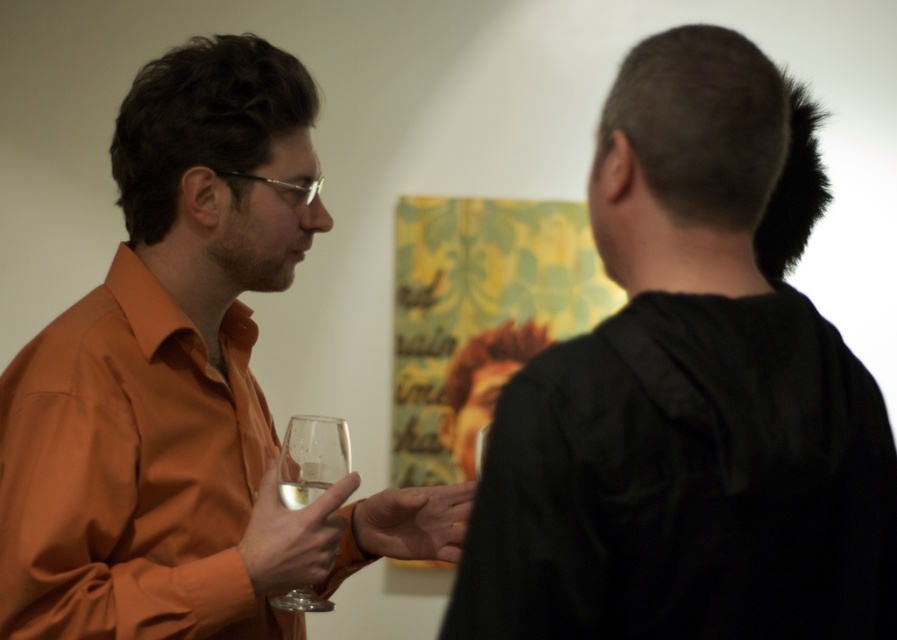
Is orange matte shirt at left smaller than clear glass wine glass at center?

No.

Does orange matte shirt at left appear on the left side of clear glass wine glass at center?

Correct, you'll find orange matte shirt at left to the left of clear glass wine glass at center.

Does point (24, 532) lie in front of point (324, 440)?

Yes, it is.

Where is `orange matte shirt at left`? orange matte shirt at left is located at coordinates (185, 387).

Is black matte shirt at upper right thinner than clear glass wine at center?

Incorrect, black matte shirt at upper right's width is not less than clear glass wine at center's.

Between black matte shirt at upper right and clear glass wine at center, which one appears on the right side from the viewer's perspective?

black matte shirt at upper right is more to the right.

Does point (747, 355) come behind point (316, 484)?

No, (747, 355) is in front of (316, 484).

Identify the location of black matte shirt at upper right. (689, 396).

From the picture: Between orange matte shirt at left and clear glass wine at center, which one has more height?

orange matte shirt at left is taller.

Is point (342, 552) positioned behind point (284, 493)?

Yes.

You are a GUI agent. You are given a task and a screenshot of the screen. Output one action in this format:
    pyautogui.click(x=<x>, y=<y>)
    Task: Click on the orange matte shirt at left
    This screenshot has height=640, width=897.
    Given the screenshot: What is the action you would take?
    pyautogui.click(x=185, y=387)